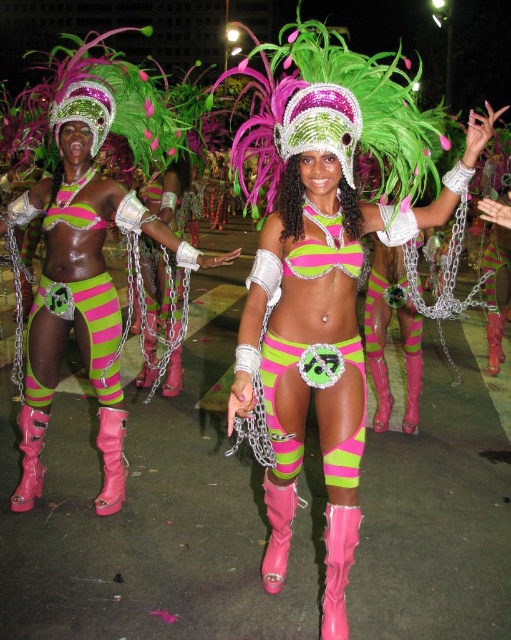
Question: Where is neon green matte bikini top at upper center located in relation to pink matte bikini top at center in the image?

Choices:
 (A) below
 (B) above

Answer: (A)

Question: Can you confirm if neon green matte bikini top at upper center is bigger than pink matte bikini top at center?

Choices:
 (A) no
 (B) yes

Answer: (B)

Question: Is neon green matte bikini top at upper center closer to camera compared to pink matte bikini top at center?

Choices:
 (A) no
 (B) yes

Answer: (A)

Question: Which of these objects is positioned closest to the neon green matte bikini top at upper center?

Choices:
 (A) pink matte bikini top at center
 (B) neon green matte bikini top at center

Answer: (B)

Question: Which point is closer to the camera taking this photo?

Choices:
 (A) (63, 298)
 (B) (320, 273)

Answer: (B)

Question: Considering the real-world distances, which object is farthest from the neon green matte bikini top at center?

Choices:
 (A) pink matte bikini top at center
 (B) neon green matte bikini top at upper center

Answer: (B)